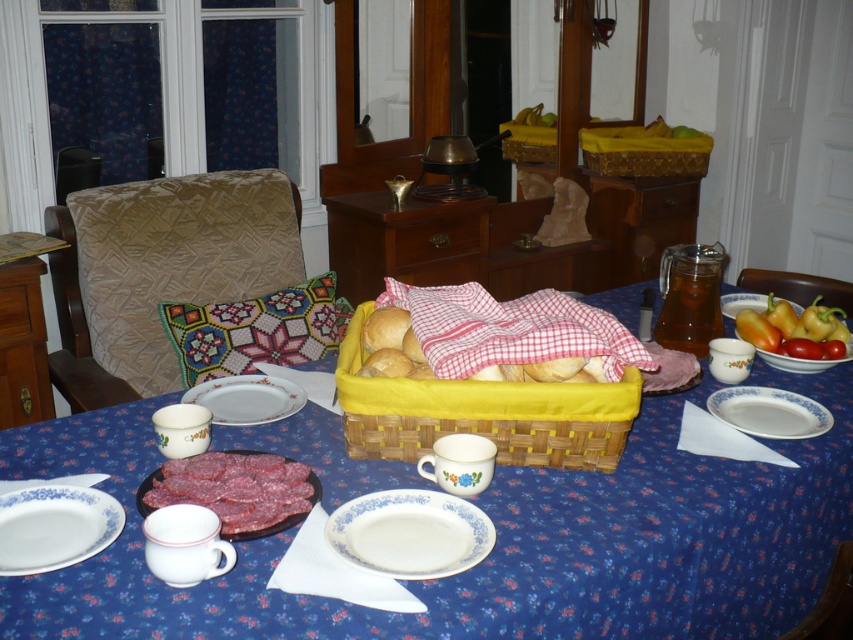
You are sitting at the dining table and want to reach both the point at (x=640, y=156) and the point at (x=762, y=333). Which point is closer to you?

Point (x=640, y=156) is closer to you because it is further to the camera than point (x=762, y=333).

You are setting up a table for a dinner party and need to place a tall centerpiece. You have a red checkered cloth at center and smooth yellow peppers at right on the table. Which item can you use as the centerpiece because it is taller?

The red checkered cloth at center can be used as the centerpiece because it has a greater height compared to the smooth yellow peppers at right.

You are sitting at the dining table and want to reach for the bread in the yellow woven basket at upper center and the smooth yellow peppers at right. Which item is closer to you?

The yellow woven basket at upper center is closer to you because it is positioned further to the viewer than the smooth yellow peppers at right.